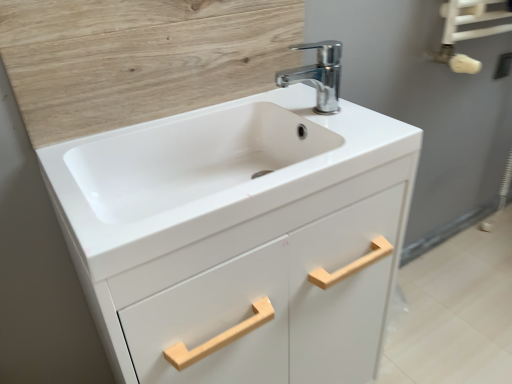
Measure the distance between wooden panel at upper left and camera.

63.84 centimeters.

Where is `white glossy towel rack at upper right`? white glossy towel rack at upper right is located at coordinates (426, 105).

Considering the relative sizes of wooden panel at upper left and white glossy sink at center in the image provided, is wooden panel at upper left bigger than white glossy sink at center?

No.

Relative to white glossy sink at center, is wooden panel at upper left in front or behind?

wooden panel at upper left is behind white glossy sink at center.

Which of these two, wooden panel at upper left or white glossy sink at center, stands taller?

wooden panel at upper left is taller.

Is wooden panel at upper left not inside white glossy sink at center?

Yes, wooden panel at upper left is not within white glossy sink at center.

How many degrees apart are the facing directions of white glossy towel rack at upper right and chrome metallic faucet at upper center?

The angle between the facing direction of white glossy towel rack at upper right and the facing direction of chrome metallic faucet at upper center is 89.3 degrees.

Considering the sizes of objects white glossy towel rack at upper right and chrome metallic faucet at upper center in the image provided, who is thinner, white glossy towel rack at upper right or chrome metallic faucet at upper center?

Thinner between the two is chrome metallic faucet at upper center.

Is white glossy towel rack at upper right completely or partially outside of chrome metallic faucet at upper center?

white glossy towel rack at upper right lies outside chrome metallic faucet at upper center's area.

How distant is white glossy towel rack at upper right from chrome metallic faucet at upper center?

white glossy towel rack at upper right is 23.18 inches away from chrome metallic faucet at upper center.

Between white glossy sink at center and chrome metallic faucet at upper center, which one has larger width?

white glossy sink at center.

Is white glossy sink at center taller or shorter than chrome metallic faucet at upper center?

Clearly, white glossy sink at center is shorter compared to chrome metallic faucet at upper center.

Looking at the image, does white glossy sink at center seem bigger or smaller compared to chrome metallic faucet at upper center?

white glossy sink at center is bigger than chrome metallic faucet at upper center.

From a real-world perspective, is white matte cabinet at center positioned above or below white glossy sink at center?

In terms of real-world spatial position, white matte cabinet at center is below white glossy sink at center.

Does point (289, 306) lie behind point (144, 170)?

That is False.

In the scene shown: Is white matte cabinet at center turned away from white glossy sink at center?

No, white matte cabinet at center is not facing away from white glossy sink at center.

Is white matte cabinet at center situated inside white glossy sink at center or outside?

white matte cabinet at center cannot be found inside white glossy sink at center.

Between point (141, 41) and point (462, 104), which one is positioned in front?

The point (141, 41) is in front.

Which of these two, wooden panel at upper left or white glossy towel rack at upper right, stands shorter?

With less height is wooden panel at upper left.

Looking at the image, does wooden panel at upper left seem bigger or smaller compared to white glossy towel rack at upper right?

Considering their sizes, wooden panel at upper left takes up less space than white glossy towel rack at upper right.

Between white glossy towel rack at upper right and white glossy sink at center, which one appears on the left side from the viewer's perspective?

Positioned to the left is white glossy sink at center.

From a real-world perspective, between white glossy towel rack at upper right and white glossy sink at center, who is vertically lower?

From a 3D spatial view, white glossy towel rack at upper right is below.

In the scene shown: How far apart are white glossy towel rack at upper right and white glossy sink at center?

A distance of 23.24 inches exists between white glossy towel rack at upper right and white glossy sink at center.

Which of these two, white glossy towel rack at upper right or white glossy sink at center, is thinner?

Thinner between the two is white glossy towel rack at upper right.

Considering the positions of point (413, 243) and point (360, 222), is point (413, 243) closer or farther from the camera than point (360, 222)?

Point (413, 243).

In the image, is white glossy towel rack at upper right positioned in front of or behind white matte cabinet at center?

In the image, white glossy towel rack at upper right appears behind white matte cabinet at center.

How distant is white glossy towel rack at upper right from white matte cabinet at center?

56.69 centimeters.

Consider the image. Is white glossy towel rack at upper right surrounding white matte cabinet at center?

No, white matte cabinet at center is not a part of white glossy towel rack at upper right.

The height and width of the screenshot is (384, 512). In order to click on plywood located on the left of white glossy sink at center in this screenshot , I will do `click(139, 58)`.

The height and width of the screenshot is (384, 512). Identify the location of tap above the white glossy towel rack at upper right (from the image's perspective). (318, 74).

From the image, which object appears to be farther from white matte cabinet at center, white glossy sink at center or white glossy towel rack at upper right?

white glossy towel rack at upper right is further to white matte cabinet at center.

Looking at the image, which one is located further to chrome metallic faucet at upper center, wooden panel at upper left or white glossy towel rack at upper right?

white glossy towel rack at upper right is positioned further to the anchor chrome metallic faucet at upper center.

Estimate the real-world distances between objects in this image. Which object is closer to white matte cabinet at center, white glossy towel rack at upper right or white glossy sink at center?

Based on the image, white glossy sink at center appears to be nearer to white matte cabinet at center.

Estimate the real-world distances between objects in this image. Which object is further from white glossy towel rack at upper right, white matte cabinet at center or white glossy sink at center?

The object further to white glossy towel rack at upper right is white glossy sink at center.

From the image, which object appears to be nearer to wooden panel at upper left, chrome metallic faucet at upper center or white glossy sink at center?

white glossy sink at center lies closer to wooden panel at upper left than the other object.

When comparing their distances from white glossy sink at center, does wooden panel at upper left or chrome metallic faucet at upper center seem closer?

wooden panel at upper left.

Considering their positions, is white glossy towel rack at upper right positioned further to chrome metallic faucet at upper center than white matte cabinet at center?

white glossy towel rack at upper right.

Which object lies nearer to the anchor point white glossy sink at center, chrome metallic faucet at upper center or wooden panel at upper left?

wooden panel at upper left.

This screenshot has width=512, height=384. I want to click on sink between wooden panel at upper left and white matte cabinet at center from top to bottom, so click(191, 159).

Find the location of a particular element. sink located between wooden panel at upper left and chrome metallic faucet at upper center in the left-right direction is located at coordinates (191, 159).

Identify the location of bathroom cabinet between wooden panel at upper left and white glossy towel rack at upper right from left to right. The width and height of the screenshot is (512, 384). (239, 238).

This screenshot has width=512, height=384. Identify the location of tap between wooden panel at upper left and white glossy towel rack at upper right in the horizontal direction. (318, 74).